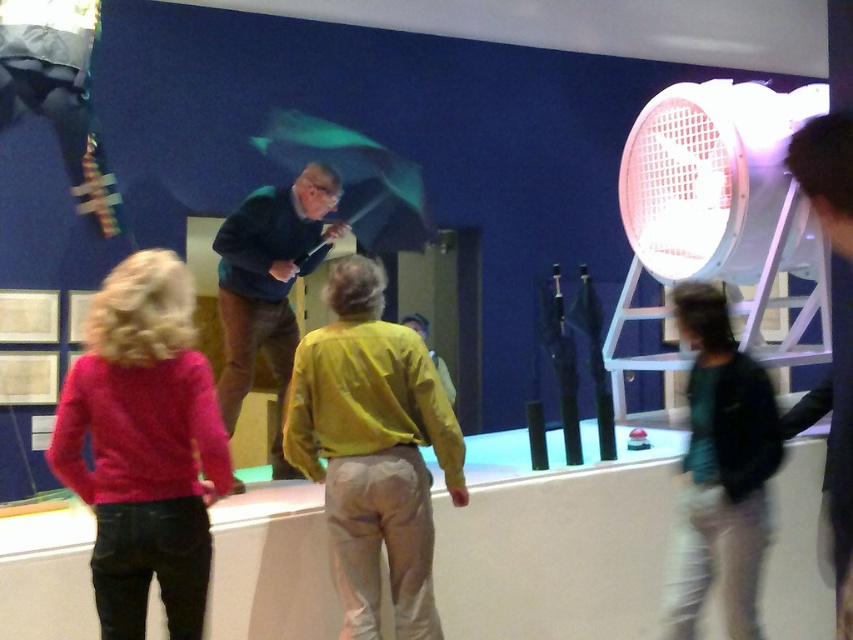
Question: Is green matte jacket at lower right positioned at the back of dark green sweater at center?

Choices:
 (A) yes
 (B) no

Answer: (B)

Question: Which object is farther from the camera taking this photo?

Choices:
 (A) dark green sweater at center
 (B) pink sweater at lower left
 (C) yellow fabric shirt at center
 (D) green matte jacket at lower right

Answer: (A)

Question: Which is nearer to the dark green sweater at center?

Choices:
 (A) green matte jacket at lower right
 (B) yellow fabric shirt at center

Answer: (B)

Question: Among these objects, which one is farthest from the camera?

Choices:
 (A) green matte jacket at lower right
 (B) dark green sweater at center

Answer: (B)

Question: Where is yellow fabric shirt at center located in relation to dark green sweater at center in the image?

Choices:
 (A) right
 (B) left

Answer: (A)

Question: Does yellow fabric shirt at center appear over dark green sweater at center?

Choices:
 (A) yes
 (B) no

Answer: (B)